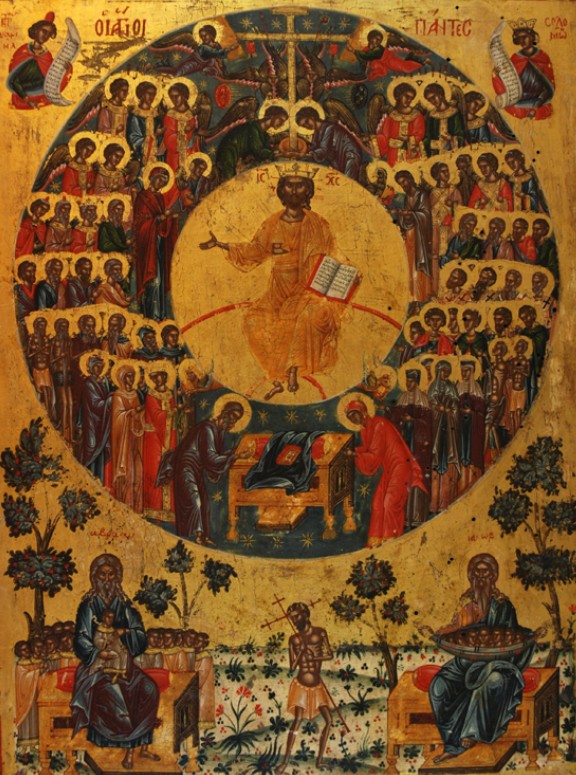
At what (x,y) coordinates should I click in order to perform the action: click on robe. Please return your answer as a coordinate pair (x, y). Image resolution: width=576 pixels, height=775 pixels. Looking at the image, I should click on (473, 683).